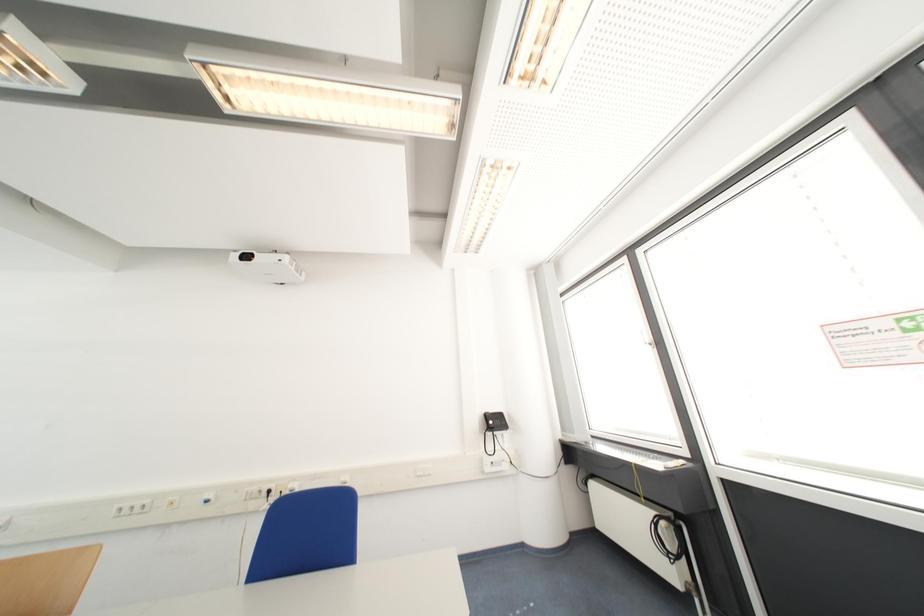
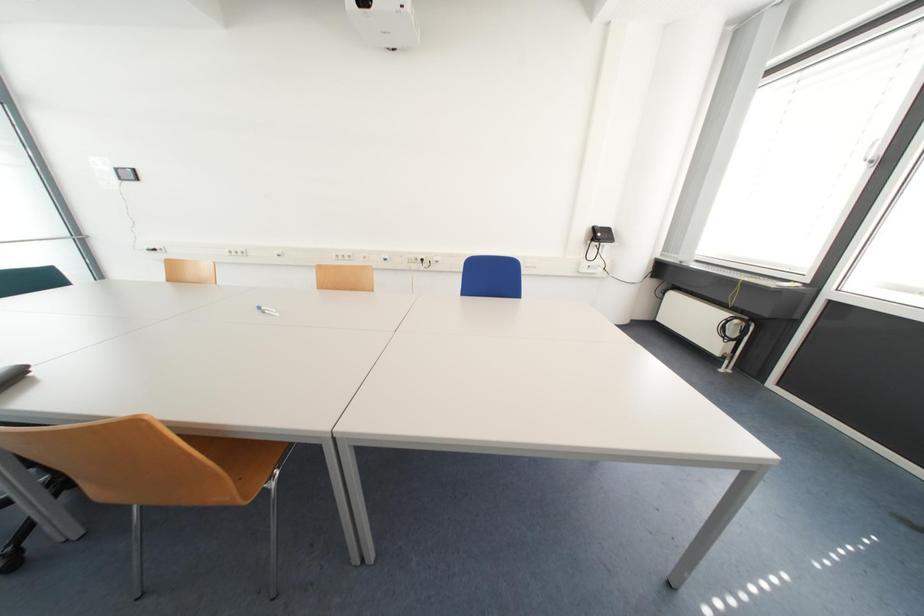
Question: The images are taken continuously from a first-person perspective. In which direction is your viewpoint rotating?

Choices:
 (A) Left
 (B) Right
 (C) Up
 (D) Down

Answer: (D)